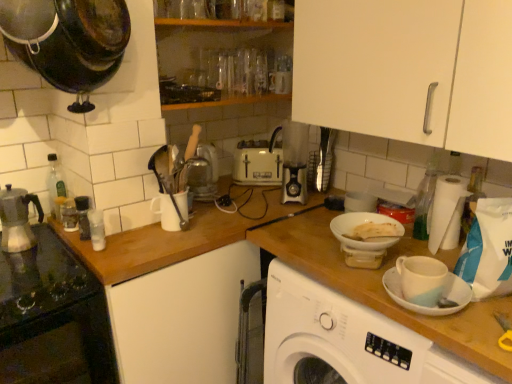
Locate an element on the screen. free space to the right of black plastic grinder at left, positioned as the 2th bottle in left-to-right order is located at coordinates (124, 228).